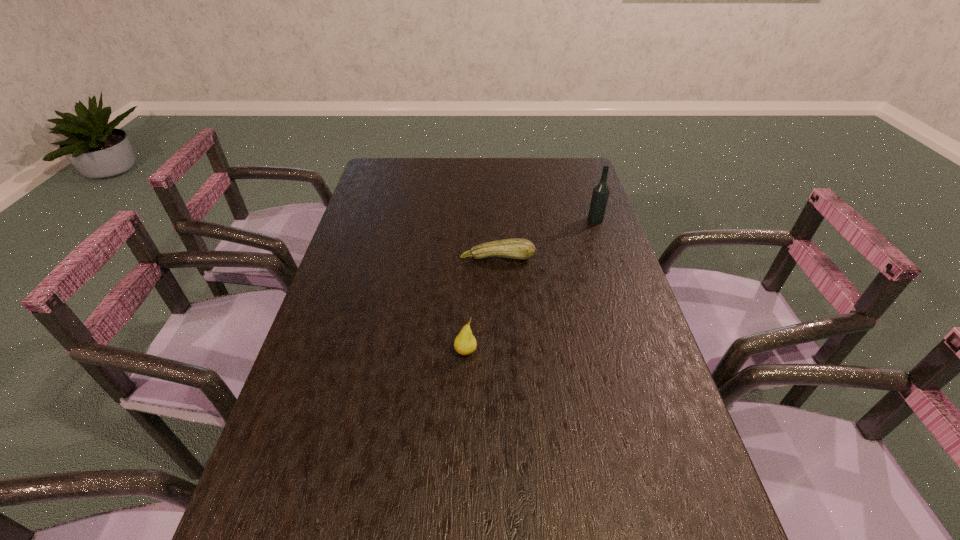
The width and height of the screenshot is (960, 540). I want to click on blank space at the far edge of the desktop, so click(x=434, y=173).

At what (x,y) coordinates should I click in order to perform the action: click on vacant area at the left edge of the desktop. Please return your answer as a coordinate pair (x, y). This screenshot has width=960, height=540. Looking at the image, I should click on (289, 418).

Locate an element on the screen. This screenshot has height=540, width=960. free region at the right edge of the desktop is located at coordinates (667, 536).

I want to click on vacant space at the far left corner of the desktop, so click(382, 164).

Where is `blank space at the far right corner`? This screenshot has width=960, height=540. blank space at the far right corner is located at coordinates (558, 183).

Find the location of `free spot between the shortest object and the farthest object`. free spot between the shortest object and the farthest object is located at coordinates (546, 238).

Where is `free area in between the shortest object and the pear`? The height and width of the screenshot is (540, 960). free area in between the shortest object and the pear is located at coordinates (482, 305).

The width and height of the screenshot is (960, 540). In order to click on free space between the second nearest object and the second shortest object in this screenshot , I will do `click(482, 305)`.

The width and height of the screenshot is (960, 540). What are the coordinates of `free area in between the second shortest object and the farthest object` in the screenshot? It's located at (531, 286).

This screenshot has width=960, height=540. I want to click on object that stands as the closest to the second tallest object, so click(516, 248).